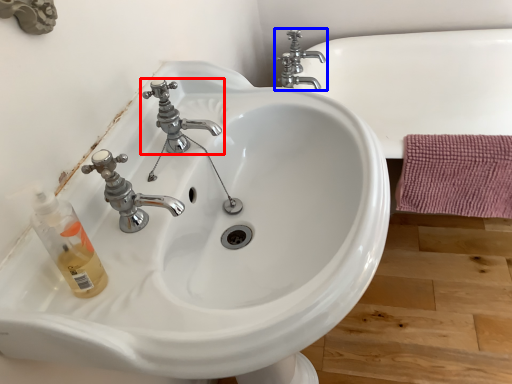
Question: Which point is closer to the camera, tap (highlighted by a red box) or tap (highlighted by a blue box)?

Choices:
 (A) tap
 (B) tap

Answer: (A)